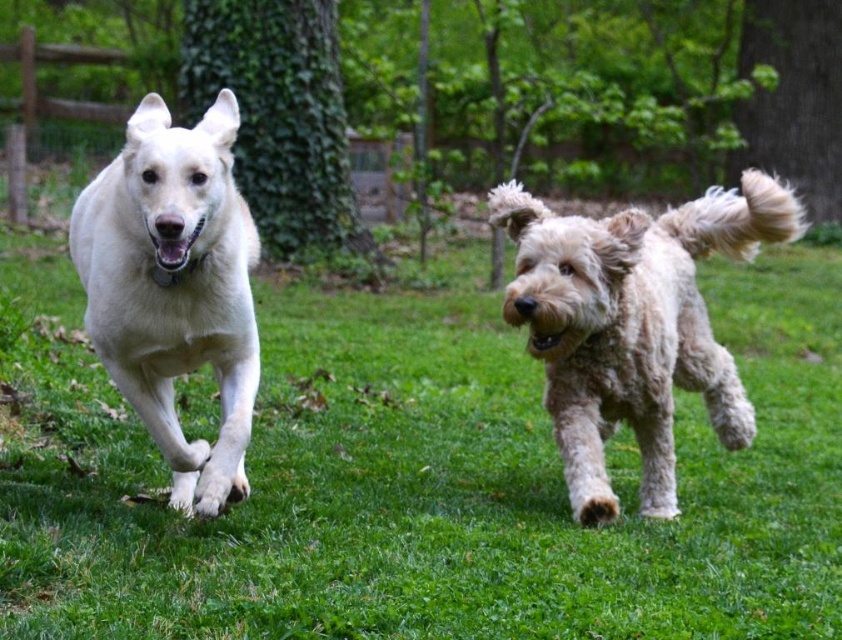
Question: From the image, what is the correct spatial relationship of green grass at center in relation to white fluffy dog at left?

Choices:
 (A) left
 (B) right

Answer: (B)

Question: Which point is farther to the camera?

Choices:
 (A) click(249, 401)
 (B) click(489, 204)

Answer: (B)

Question: Which point is farther to the camera?

Choices:
 (A) (235, 500)
 (B) (573, 497)

Answer: (B)

Question: Based on their relative distances, which object is nearer to the fuzzy beige dog at right?

Choices:
 (A) white fluffy dog at left
 (B) green grass at center

Answer: (A)

Question: Does green grass at center have a smaller size compared to fuzzy beige dog at right?

Choices:
 (A) no
 (B) yes

Answer: (A)

Question: Does fuzzy beige dog at right have a larger size compared to white fluffy dog at left?

Choices:
 (A) no
 (B) yes

Answer: (B)